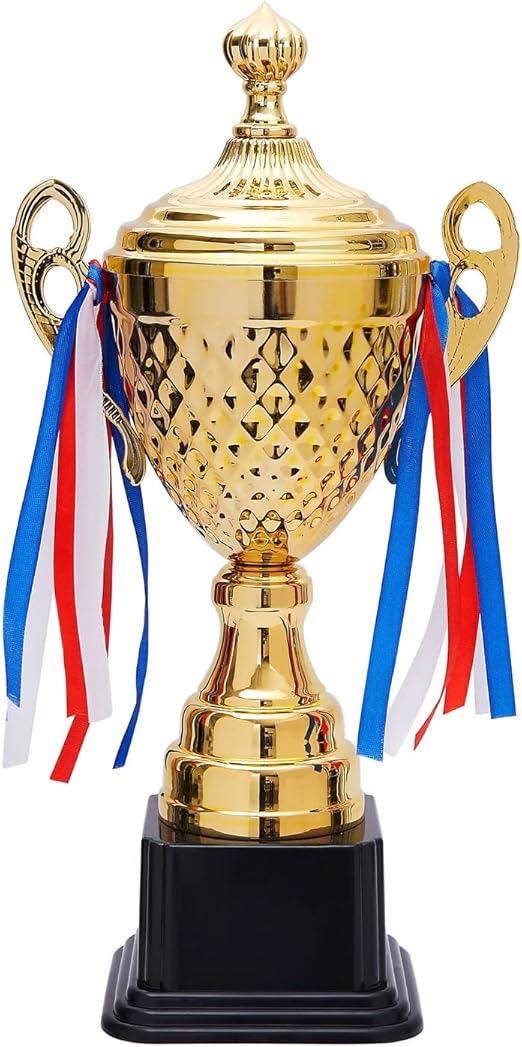
This screenshot has height=1047, width=522. Find the location of `gold trophy chalice`. gold trophy chalice is located at coordinates (279, 280).